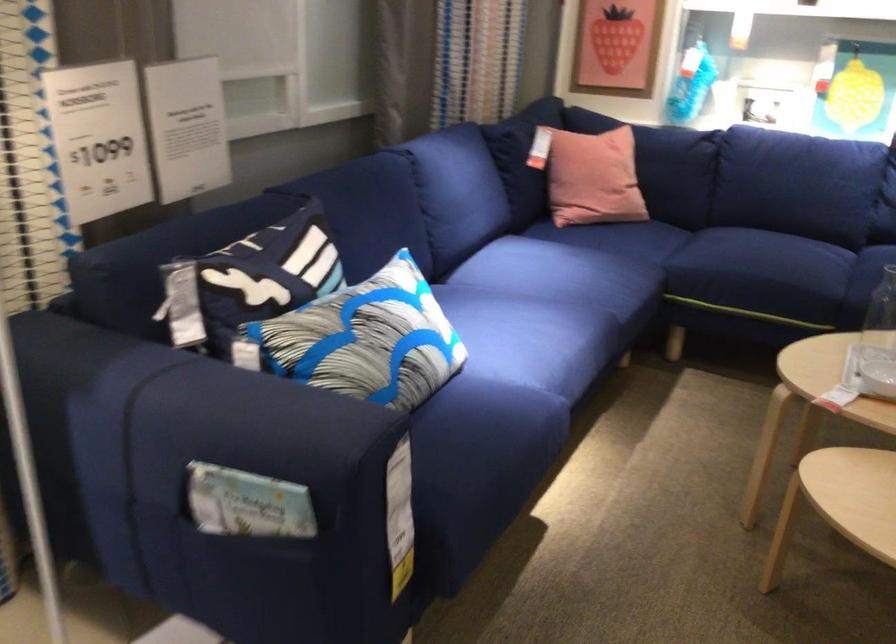
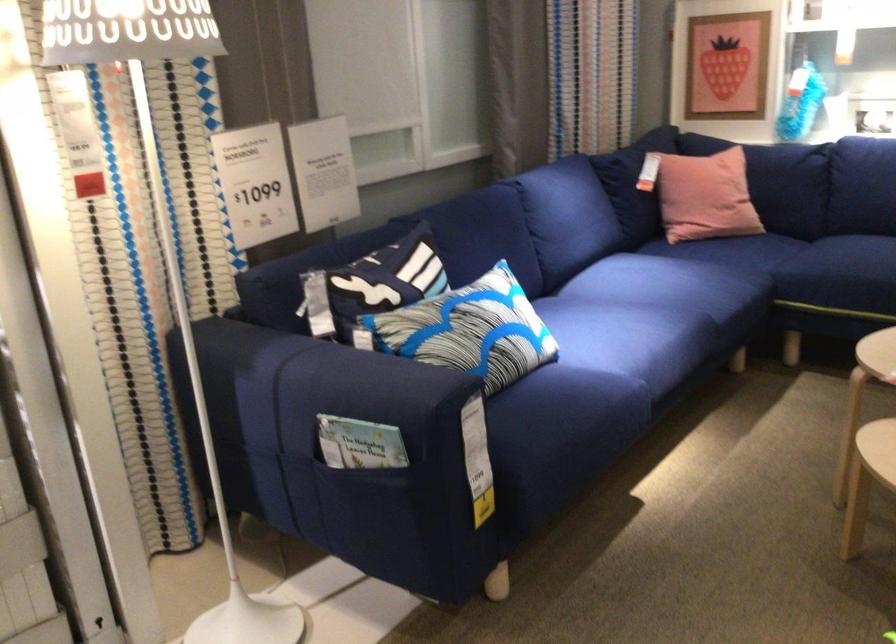
Find the pixel in the second image that matches point 99,379 in the first image.

(254, 361)